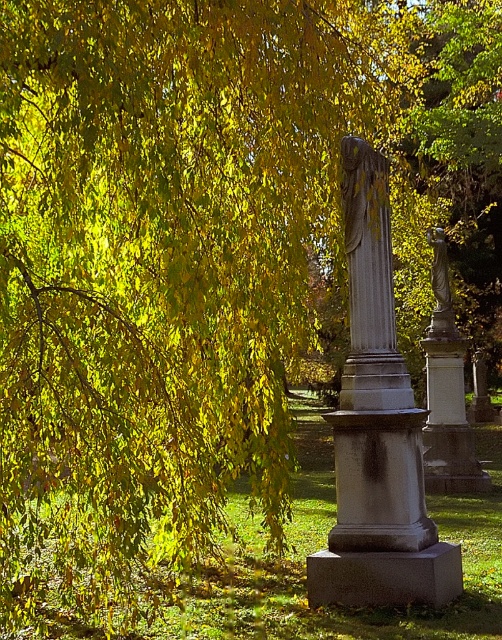
Question: Which point is farther to the camera?

Choices:
 (A) (437, 307)
 (B) (401, 388)

Answer: (A)

Question: Does gray stone statue at center have a smaller size compared to bronze statue at right?

Choices:
 (A) yes
 (B) no

Answer: (A)

Question: Is gray stone statue at center above bronze statue at right?

Choices:
 (A) no
 (B) yes

Answer: (A)

Question: From the image, what is the correct spatial relationship of gray stone statue at center in relation to bronze statue at right?

Choices:
 (A) below
 (B) above

Answer: (A)